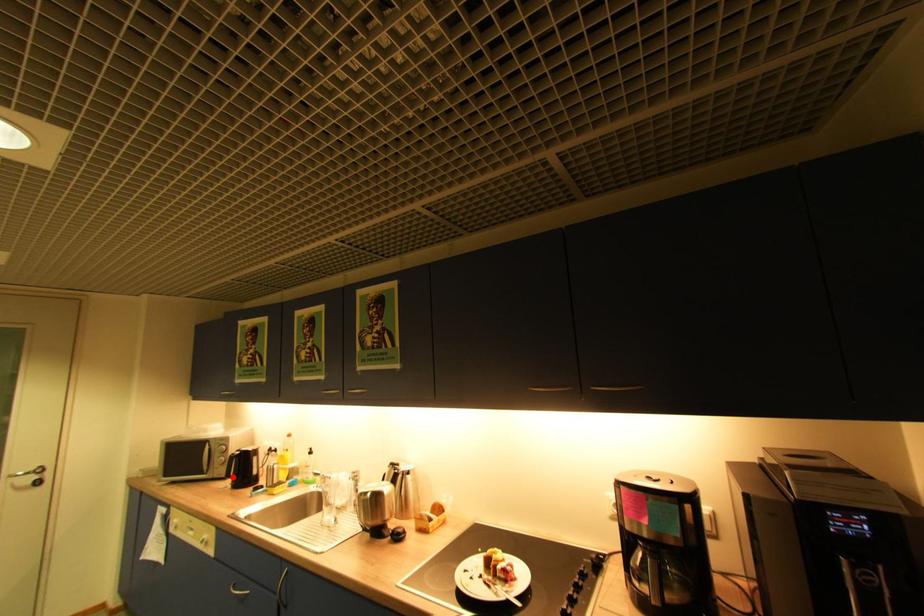
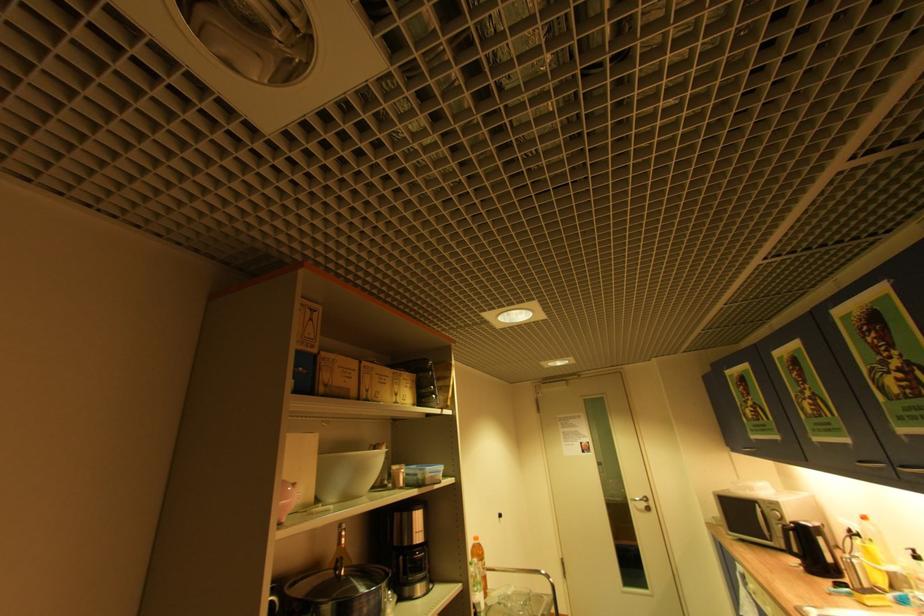
The point at the highlighted location is marked in the first image. Where is the corresponding point in the second image?

(796, 554)